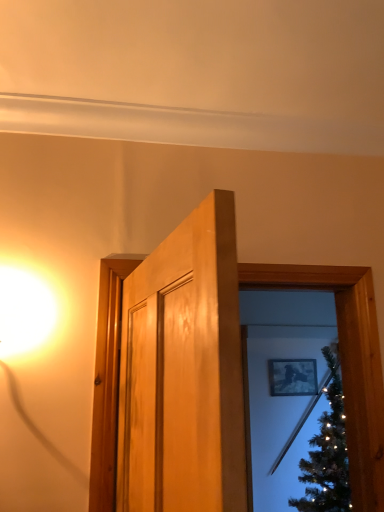
The image size is (384, 512). What do you see at coordinates (292, 377) in the screenshot? I see `matte black picture frame at upper center` at bounding box center [292, 377].

Identify the location of wooden door frame at center, which is counted as the 1th window frame, starting from the back. (346, 362).

Could you tell me if wooden door frame at center, arranged as the 2th window frame when viewed from the front, is facing wooden door at center, the 1th window frame in the front-to-back sequence?

No.

Image resolution: width=384 pixels, height=512 pixels. What are the coordinates of `window frame located below the wooden door at center, the 1th window frame in the front-to-back sequence (from the image's perspective)` in the screenshot? It's located at (346, 362).

Which object is wider, wooden door frame at center, arranged as the 2th window frame when viewed from the front, or wooden door at center, the 1th window frame in the front-to-back sequence?

With larger width is wooden door frame at center, arranged as the 2th window frame when viewed from the front.

Considering the relative sizes of wooden door frame at center, arranged as the 2th window frame when viewed from the front, and wooden door at center, marked as the second window frame in a back-to-front arrangement, in the image provided, is wooden door frame at center, arranged as the 2th window frame when viewed from the front, shorter than wooden door at center, marked as the second window frame in a back-to-front arrangement,?

Correct, wooden door frame at center, arranged as the 2th window frame when viewed from the front, is not as tall as wooden door at center, marked as the second window frame in a back-to-front arrangement.

From a real-world perspective, is wooden door at center, marked as the second window frame in a back-to-front arrangement, physically below wooden door frame at center, arranged as the 2th window frame when viewed from the front?

No.

Can you confirm if wooden door at center, marked as the second window frame in a back-to-front arrangement, is thinner than wooden door frame at center, arranged as the 2th window frame when viewed from the front?

Indeed, wooden door at center, marked as the second window frame in a back-to-front arrangement, has a lesser width compared to wooden door frame at center, arranged as the 2th window frame when viewed from the front.

Would you say wooden door at center, marked as the second window frame in a back-to-front arrangement, is to the left or to the right of wooden door frame at center, which is counted as the 1th window frame, starting from the back, in the picture?

wooden door at center, marked as the second window frame in a back-to-front arrangement, is positioned on wooden door frame at center, which is counted as the 1th window frame, starting from the back,'s left side.

From the image's perspective, is wooden door at center, the 1th window frame in the front-to-back sequence, located above or below wooden door frame at center, arranged as the 2th window frame when viewed from the front?

Clearly, from the image's perspective, wooden door at center, the 1th window frame in the front-to-back sequence, is above wooden door frame at center, arranged as the 2th window frame when viewed from the front.

Is wooden door at center, marked as the second window frame in a back-to-front arrangement, positioned with its back to matte black picture frame at upper center?

Absolutely, wooden door at center, marked as the second window frame in a back-to-front arrangement, is directed away from matte black picture frame at upper center.

Which is closer, (366, 439) or (295, 390)?

Point (366, 439)

Is wooden door at center, the 1th window frame in the front-to-back sequence, behind matte black picture frame at upper center?

No, the depth of wooden door at center, the 1th window frame in the front-to-back sequence, is less than that of matte black picture frame at upper center.

Considering the positions of points (295, 395) and (364, 271), is point (295, 395) closer to camera compared to point (364, 271)?

No, (295, 395) is further to viewer.

Considering the sizes of matte black picture frame at upper center and wooden door at center, marked as the second window frame in a back-to-front arrangement, in the image, is matte black picture frame at upper center taller or shorter than wooden door at center, marked as the second window frame in a back-to-front arrangement,?

In the image, matte black picture frame at upper center appears to be shorter than wooden door at center, marked as the second window frame in a back-to-front arrangement.

Image resolution: width=384 pixels, height=512 pixels. Identify the location of picture frame located behind the wooden door at center, the 1th window frame in the front-to-back sequence. (292, 377).

From a real-world perspective, who is located higher, matte black picture frame at upper center or wooden door at center, the 1th window frame in the front-to-back sequence?

wooden door at center, the 1th window frame in the front-to-back sequence, from a real-world perspective.

Identify the location of window frame that is under the matte black picture frame at upper center (from a real-world perspective). This screenshot has height=512, width=384. (346, 362).

Could you tell me if wooden door frame at center, which is counted as the 1th window frame, starting from the back, is facing matte black picture frame at upper center?

No, wooden door frame at center, which is counted as the 1th window frame, starting from the back, is not facing towards matte black picture frame at upper center.

From a real-world perspective, is wooden door frame at center, arranged as the 2th window frame when viewed from the front, positioned over matte black picture frame at upper center based on gravity?

No, from a real-world perspective, wooden door frame at center, arranged as the 2th window frame when viewed from the front, is not on top of matte black picture frame at upper center.

Who is more distant, wooden door frame at center, which is counted as the 1th window frame, starting from the back, or matte black picture frame at upper center?

matte black picture frame at upper center.

This screenshot has height=512, width=384. There is a wooden door frame at center, arranged as the 2th window frame when viewed from the front. What are the coordinates of `picture frame above it (from a real-world perspective)` in the screenshot? It's located at (292, 377).

Does matte black picture frame at upper center come behind wooden door frame at center, arranged as the 2th window frame when viewed from the front?

Yes, matte black picture frame at upper center is behind wooden door frame at center, arranged as the 2th window frame when viewed from the front.

Consider the image. Which of these two, matte black picture frame at upper center or wooden door frame at center, arranged as the 2th window frame when viewed from the front, is thinner?

With smaller width is matte black picture frame at upper center.

Which point is more distant from viewer, (282, 370) or (368, 357)?

The point (282, 370) is more distant.

At what (x,y) coordinates should I click in order to perform the action: click on window frame lying in front of the wooden door frame at center, which is counted as the 1th window frame, starting from the back. Please return your answer as a coordinate pair (x, y). This screenshot has height=512, width=384. Looking at the image, I should click on pyautogui.click(x=346, y=361).

The height and width of the screenshot is (512, 384). In order to click on window frame that appears behind the wooden door at center, the 1th window frame in the front-to-back sequence in this screenshot , I will do `click(346, 362)`.

Consider the image. Considering their positions, is wooden door frame at center, arranged as the 2th window frame when viewed from the front, positioned closer to wooden door at center, marked as the second window frame in a back-to-front arrangement, than matte black picture frame at upper center?

Based on the image, wooden door frame at center, arranged as the 2th window frame when viewed from the front, appears to be nearer to wooden door at center, marked as the second window frame in a back-to-front arrangement.

Estimate the real-world distances between objects in this image. Which object is closer to matte black picture frame at upper center, wooden door at center, marked as the second window frame in a back-to-front arrangement, or wooden door frame at center, arranged as the 2th window frame when viewed from the front?

wooden door at center, marked as the second window frame in a back-to-front arrangement, is positioned closer to the anchor matte black picture frame at upper center.

Based on their spatial positions, is wooden door at center, marked as the second window frame in a back-to-front arrangement, or matte black picture frame at upper center further from wooden door frame at center, which is counted as the 1th window frame, starting from the back?

matte black picture frame at upper center is further to wooden door frame at center, which is counted as the 1th window frame, starting from the back.

In the scene shown: Considering their positions, is matte black picture frame at upper center positioned further to wooden door frame at center, arranged as the 2th window frame when viewed from the front, than wooden door at center, the 1th window frame in the front-to-back sequence?

Among the two, matte black picture frame at upper center is located further to wooden door frame at center, arranged as the 2th window frame when viewed from the front.

When comparing their distances from matte black picture frame at upper center, does wooden door frame at center, arranged as the 2th window frame when viewed from the front, or wooden door at center, marked as the second window frame in a back-to-front arrangement, seem further?

Among the two, wooden door frame at center, arranged as the 2th window frame when viewed from the front, is located further to matte black picture frame at upper center.

Considering their positions, is matte black picture frame at upper center positioned closer to wooden door at center, marked as the second window frame in a back-to-front arrangement, than wooden door frame at center, which is counted as the 1th window frame, starting from the back?

Among the two, wooden door frame at center, which is counted as the 1th window frame, starting from the back, is located nearer to wooden door at center, marked as the second window frame in a back-to-front arrangement.

Find the location of a particular element. The width and height of the screenshot is (384, 512). window frame between wooden door at center, marked as the second window frame in a back-to-front arrangement, and matte black picture frame at upper center from front to back is located at coordinates (346, 362).